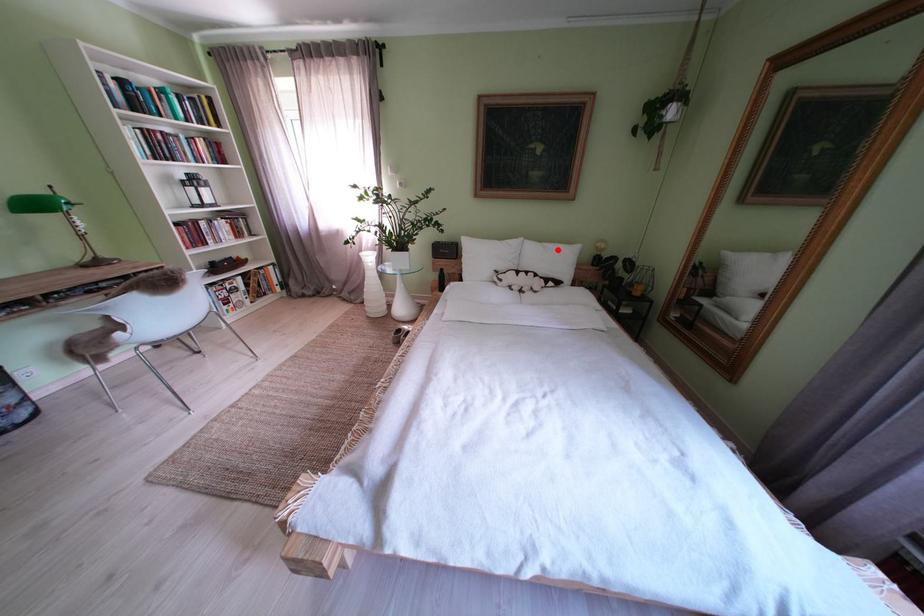
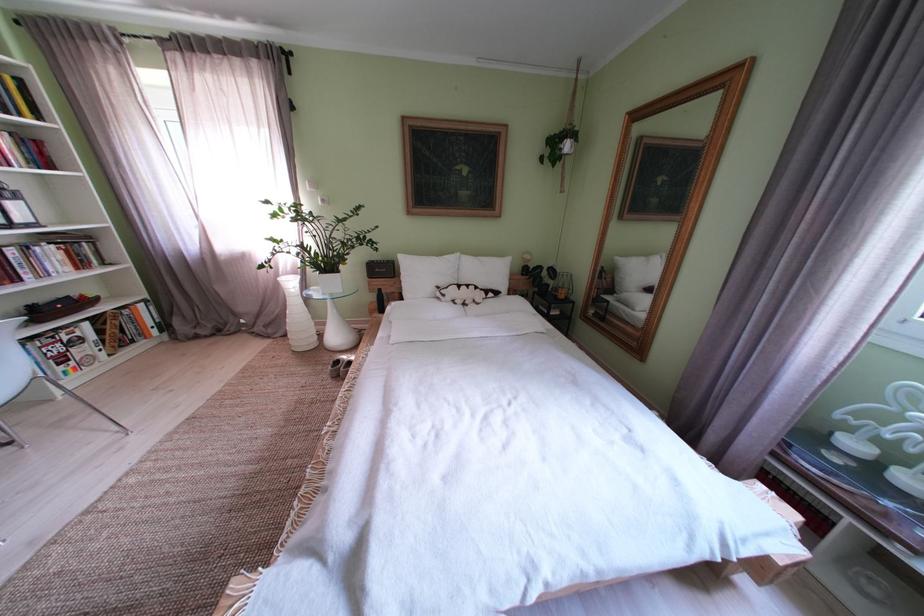
Question: I am providing you with two images of the same scene from different viewpoints. A red point is marked on the first image. Is the red point's position out of view in image 2?

Choices:
 (A) Yes
 (B) No

Answer: (B)